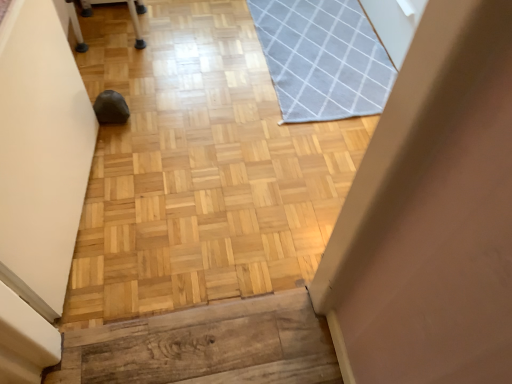
Image resolution: width=512 pixels, height=384 pixels. What are the coordinates of `vacant space that is to the left of gray woven mat at upper right` in the screenshot? It's located at (196, 62).